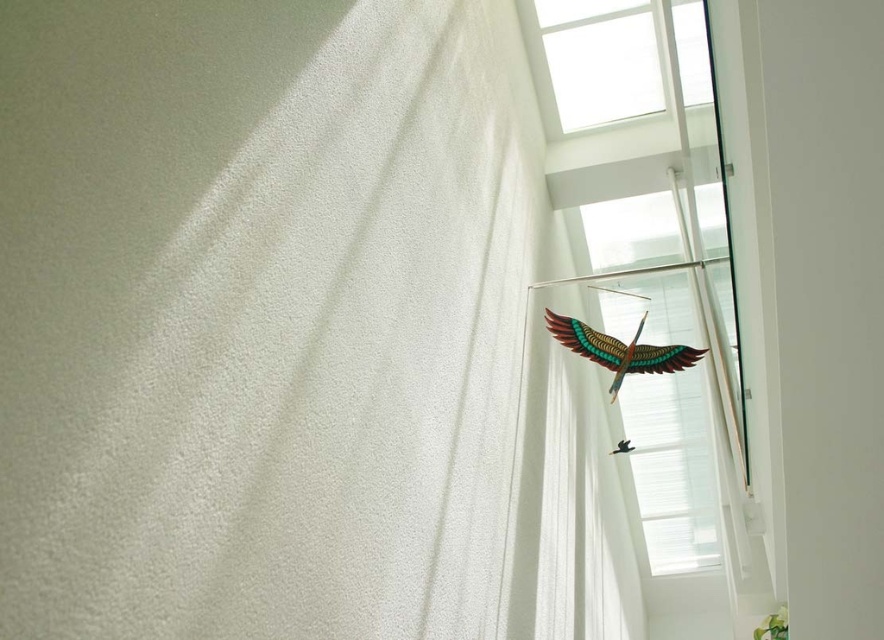
Question: Is white textured curtain at upper right behind wooden bird at upper right?

Choices:
 (A) no
 (B) yes

Answer: (A)

Question: Estimate the real-world distances between objects in this image. Which object is closer to the wooden bird at upper right?

Choices:
 (A) white textured curtain at upper right
 (B) transparent glass window at upper right

Answer: (B)

Question: Does white textured curtain at upper right appear on the right side of wooden bird at upper right?

Choices:
 (A) no
 (B) yes

Answer: (A)

Question: Among these points, which one is nearest to the camera?

Choices:
 (A) (0, 90)
 (B) (530, 17)
 (C) (697, 509)

Answer: (A)

Question: Does wooden bird at upper right have a greater width compared to transparent glass window at upper right?

Choices:
 (A) no
 (B) yes

Answer: (B)

Question: Among these points, which one is farthest from the camera?

Choices:
 (A) (581, 86)
 (B) (631, 284)

Answer: (B)